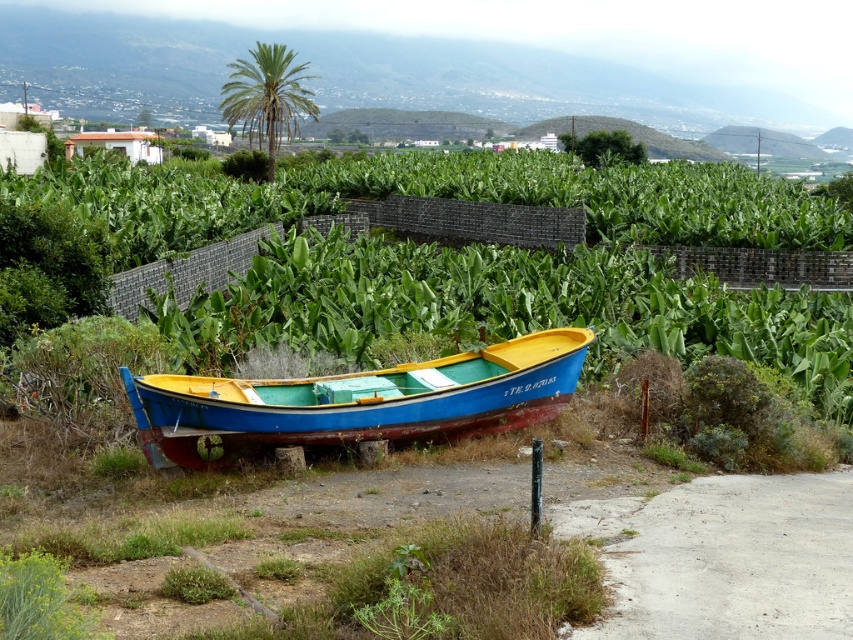
You are a photographer planning to take a photo of the blue wooden boat at center and the green leafy palm at upper center. Since you want both subjects to be clearly visible in the frame, which object should you focus on first to ensure proper focus, considering their sizes?

The blue wooden boat at center has a smaller size compared to green leafy palm at upper center, so you should focus on the blue wooden boat at center first to ensure both are in focus since it is smaller and closer to the camera.

You are standing in the rural landscape and want to take a photo of both the blue wooden boat at center and the green leafy palm at upper center. Since you have a limited field of view, will you be able to capture both in a single frame without moving your camera?

The blue wooden boat at center is closer to the viewer than the green leafy palm at upper center. Since the boat is in front, you might need to adjust your position or zoom out to include both in the frame as they are at different distances.